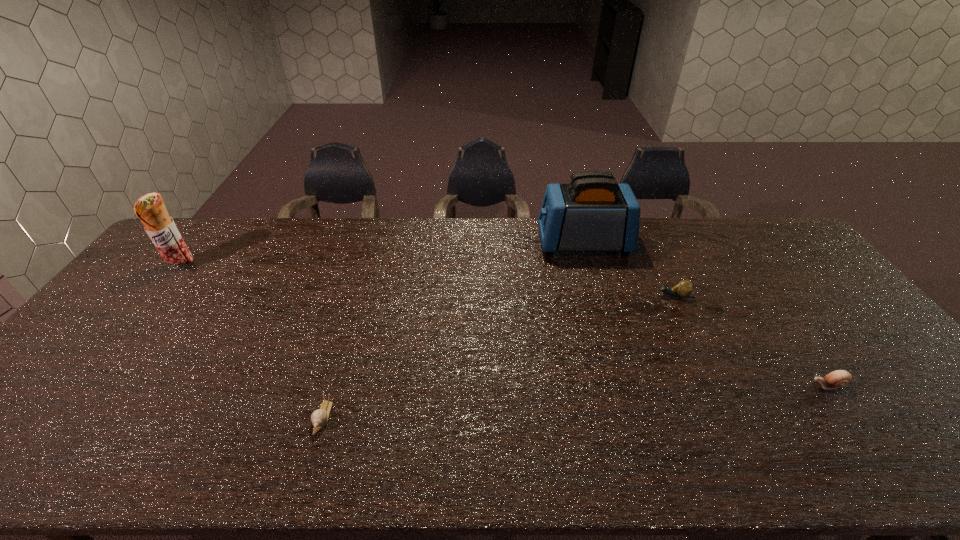
I want to click on vacant space that satisfies the following two spatial constraints: 1. on the front-facing side of the rightmost escargot; 2. on the shell of the shortest object, so pos(850,417).

I want to click on vacant point that satisfies the following two spatial constraints: 1. on the front-facing side of the third object from right to left; 2. on the shell of the shortest object, so click(635, 417).

What are the coordinates of `free region that satisfies the following two spatial constraints: 1. on the front-facing side of the second escargot from left to right; 2. on the shell of the leftmost escargot` in the screenshot? It's located at (731, 417).

This screenshot has width=960, height=540. Identify the location of free space that satisfies the following two spatial constraints: 1. on the front-facing side of the second escargot from left to right; 2. on the shell of the leftmost escargot. (731, 417).

What are the coordinates of `vacant space that satisfies the following two spatial constraints: 1. on the front-facing side of the third object from right to left; 2. on the shell of the shortest escargot` in the screenshot? It's located at (635, 417).

Find the location of `free point that satisfies the following two spatial constraints: 1. on the front-facing side of the second nearest escargot; 2. on the shell of the leftmost escargot`. free point that satisfies the following two spatial constraints: 1. on the front-facing side of the second nearest escargot; 2. on the shell of the leftmost escargot is located at coordinates (850, 417).

Image resolution: width=960 pixels, height=540 pixels. Find the location of `free point that satisfies the following two spatial constraints: 1. on the front-facing side of the third object from right to left; 2. on the shell of the nearest escargot`. free point that satisfies the following two spatial constraints: 1. on the front-facing side of the third object from right to left; 2. on the shell of the nearest escargot is located at coordinates (635, 417).